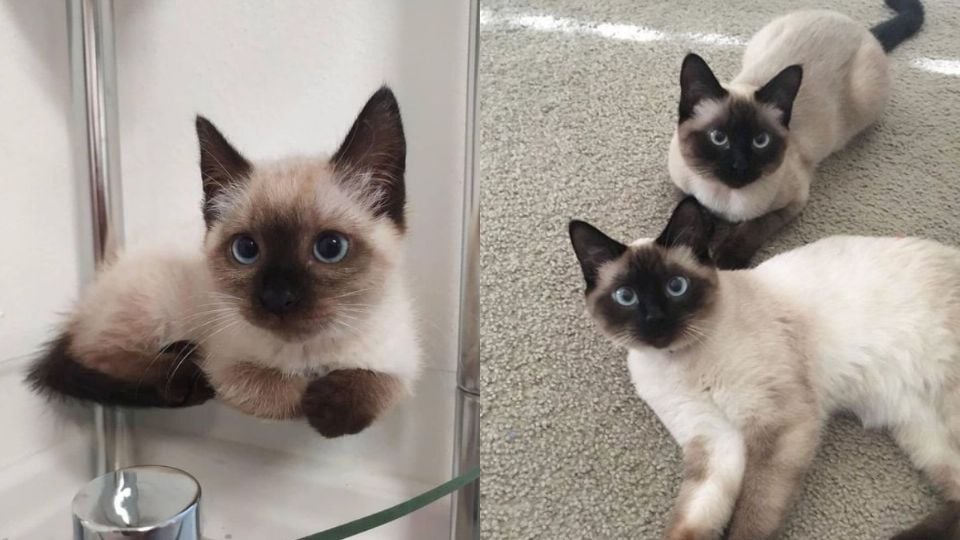
Find the location of a particular element. This screenshot has height=540, width=960. glass is located at coordinates (x=306, y=475).